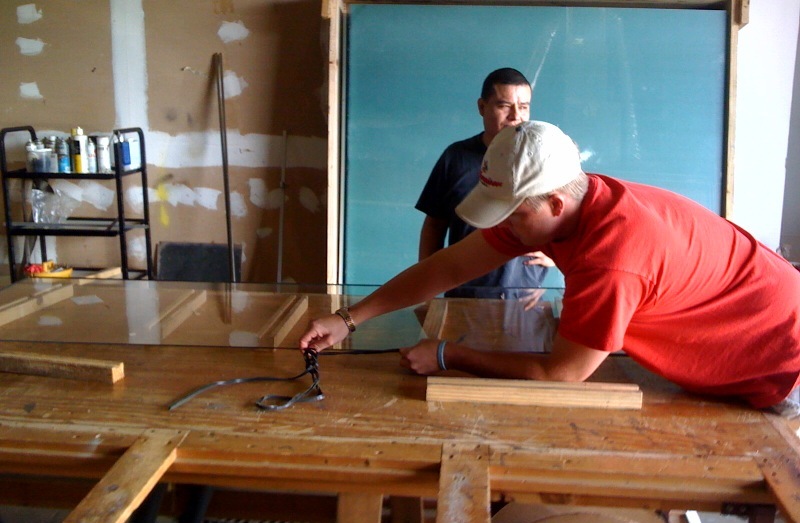
Where is `wooden planks`? The width and height of the screenshot is (800, 523). wooden planks is located at coordinates (486, 374), (474, 480), (118, 468), (98, 365).